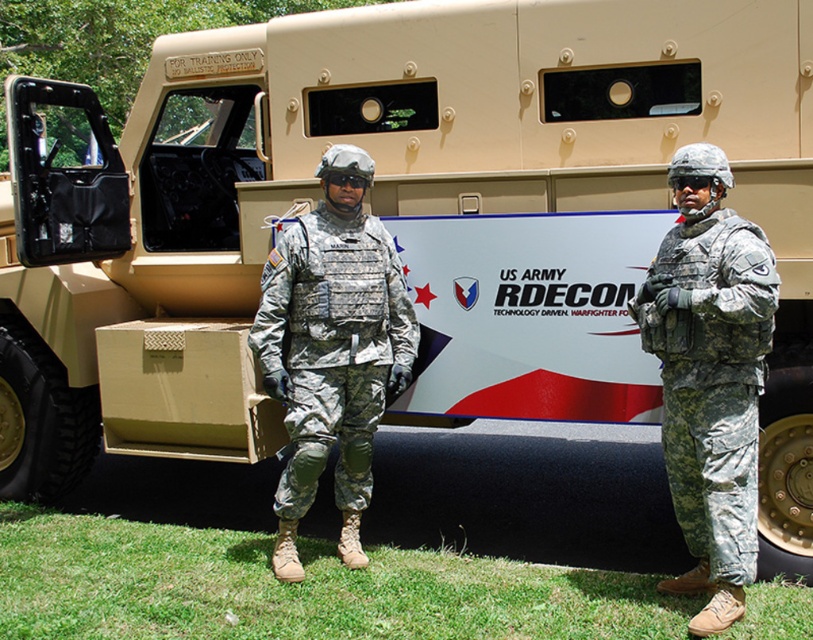
Question: Is camouflage fabric uniform at right wider than camouflage fabric vest at center?

Choices:
 (A) yes
 (B) no

Answer: (B)

Question: Is camouflage fabric uniform at right further to camera compared to camouflage fabric vest at center?

Choices:
 (A) no
 (B) yes

Answer: (A)

Question: Which object appears farthest from the camera in this image?

Choices:
 (A) camouflage fabric vest at center
 (B) camouflage fabric uniform at right

Answer: (A)

Question: Can you confirm if camouflage fabric uniform at right is bigger than camouflage fabric vest at center?

Choices:
 (A) no
 (B) yes

Answer: (B)

Question: Which point is closer to the camera?

Choices:
 (A) camouflage fabric vest at center
 (B) camouflage fabric uniform at right

Answer: (B)